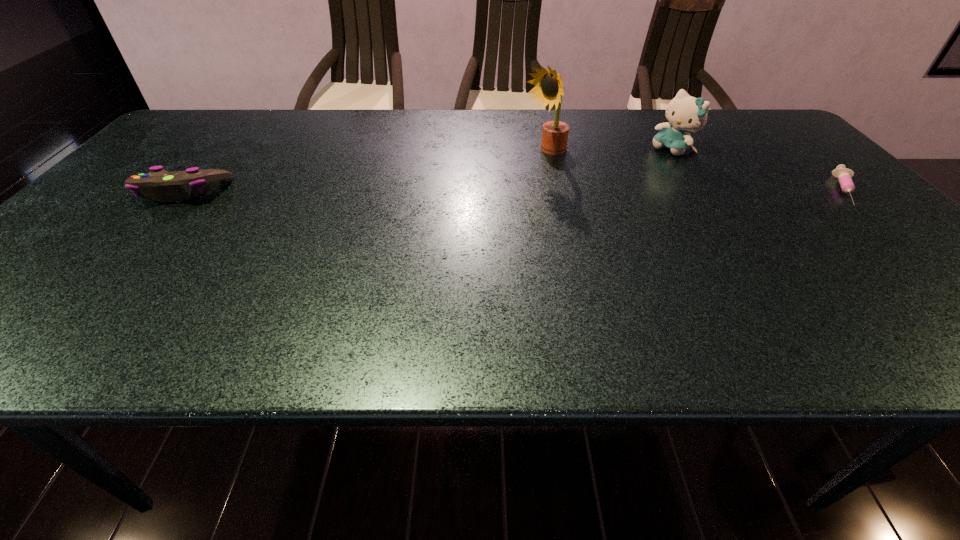
You are a GUI agent. You are given a task and a screenshot of the screen. Output one action in this format:
    pyautogui.click(x=<x>, y=<y>)
    Task: Click on the unoccupied area between the second tallest object and the control
    
    Given the screenshot: What is the action you would take?
    pyautogui.click(x=428, y=171)

Locate an element on the screen. This screenshot has width=960, height=540. free point between the control and the syringe is located at coordinates click(514, 191).

Identify the location of empty location between the second object from left to right and the rightmost object. (695, 172).

You are a GUI agent. You are given a task and a screenshot of the screen. Output one action in this format:
    pyautogui.click(x=<x>, y=<y>)
    Task: Click on the vacant space that's between the kitten and the rightmost object
    This screenshot has width=960, height=540.
    Given the screenshot: What is the action you would take?
    pyautogui.click(x=759, y=170)

This screenshot has width=960, height=540. What are the coordinates of `free area in between the second object from right to left and the control` in the screenshot? It's located at (428, 171).

At what (x,y) coordinates should I click in order to perform the action: click on free point between the third tallest object and the shortest object. Please return your answer as a coordinate pair (x, y). This screenshot has height=540, width=960. Looking at the image, I should click on (514, 191).

Identify which object is located as the third nearest to the third shortest object. Please provide its 2D coordinates. Your answer should be formatted as a tuple, i.e. [(x, y)], where the tuple contains the x and y coordinates of a point satisfying the conditions above.

[(159, 184)]

Locate an element on the screen. This screenshot has width=960, height=540. the third closest object to the second object from left to right is located at coordinates (159, 184).

Locate an element on the screen. free region that satisfies the following two spatial constraints: 1. on the back side of the kitten; 2. on the left side of the tallest object is located at coordinates (544, 150).

This screenshot has height=540, width=960. I want to click on vacant space that satisfies the following two spatial constraints: 1. on the front side of the rightmost object; 2. on the right side of the tallest object, so click(x=553, y=191).